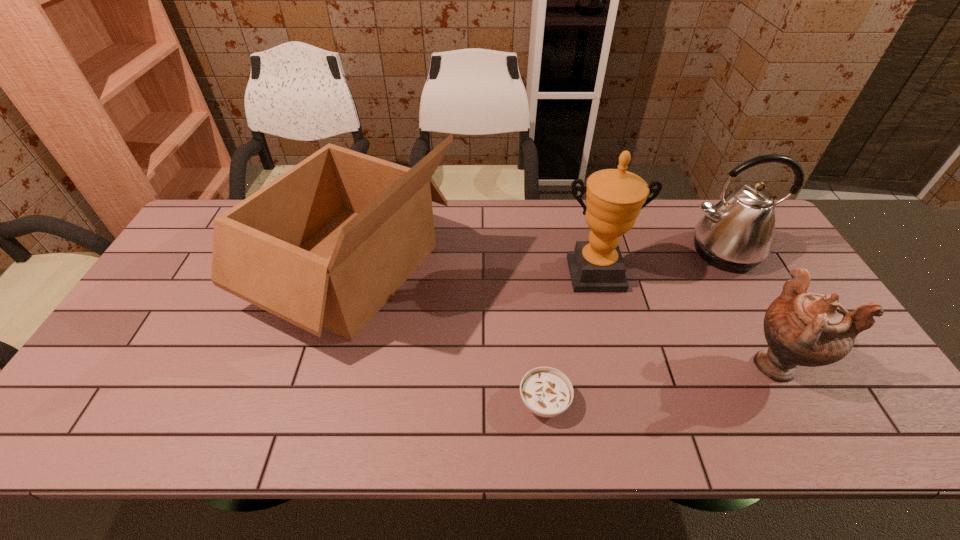
Find the location of a particular element. This screenshot has width=960, height=540. free space located on the back of the second object from left to right is located at coordinates (535, 318).

The width and height of the screenshot is (960, 540). Find the location of `box present at the far edge`. box present at the far edge is located at coordinates (326, 244).

This screenshot has height=540, width=960. Find the location of `kettle located in the far edge section of the desktop`. kettle located in the far edge section of the desktop is located at coordinates (737, 234).

You are a GUI agent. You are given a task and a screenshot of the screen. Output one action in this format:
    pyautogui.click(x=<x>, y=<y>)
    Task: Click on the object that is at the near edge
    This screenshot has height=540, width=960.
    Given the screenshot: What is the action you would take?
    pyautogui.click(x=547, y=392)

You are a GUI agent. You are given a task and a screenshot of the screen. Output one action in this format:
    pyautogui.click(x=<x>, y=<y>)
    Task: Click on the kettle present at the right edge
    This screenshot has height=540, width=960.
    Given the screenshot: What is the action you would take?
    pyautogui.click(x=737, y=234)

This screenshot has width=960, height=540. Find the location of `urn that is positioned at the right edge`. urn that is positioned at the right edge is located at coordinates (801, 328).

Where is `object positioned at the far right corner`? This screenshot has height=540, width=960. object positioned at the far right corner is located at coordinates (737, 234).

In the image, there is a desktop. Where is `vacant space at the far edge`? vacant space at the far edge is located at coordinates (649, 221).

You are a GUI agent. You are given a task and a screenshot of the screen. Output one action in this format:
    pyautogui.click(x=<x>, y=<y>)
    Task: Click on the blank space at the near edge of the desktop
    The width and height of the screenshot is (960, 540).
    Given the screenshot: What is the action you would take?
    pyautogui.click(x=708, y=407)

Identify the location of free spot at the left edge of the desktop. Image resolution: width=960 pixels, height=540 pixels. (162, 317).